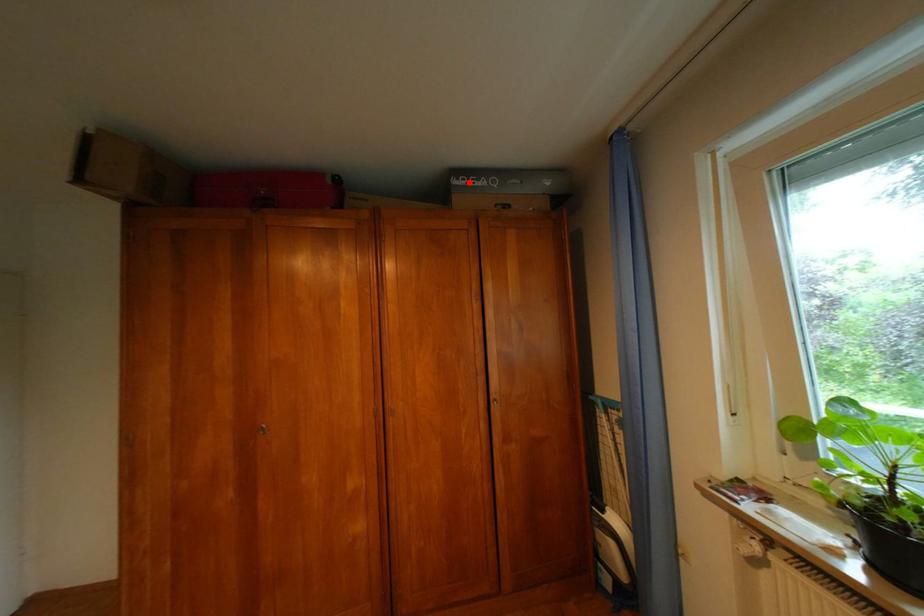
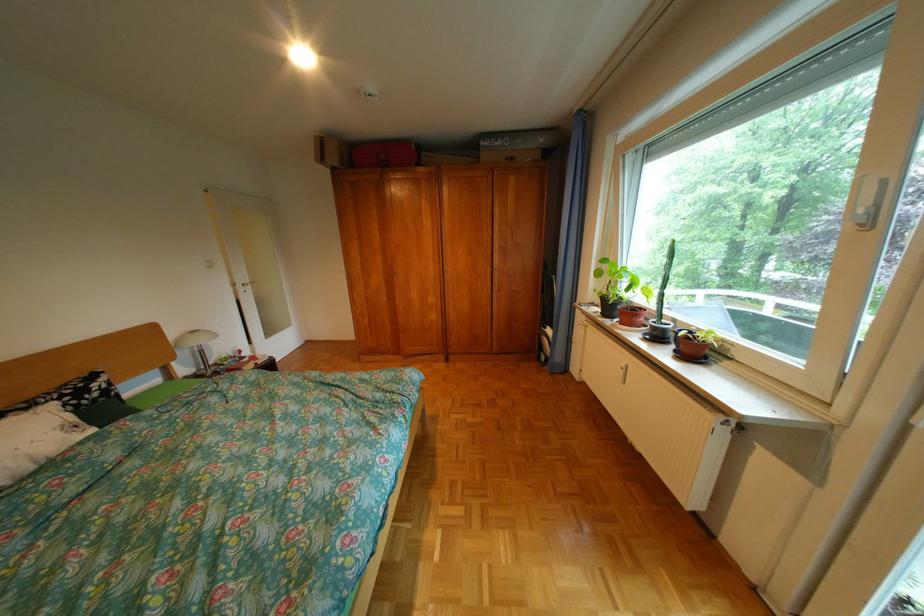
Question: A red point is marked in image1. In image2, is the corresponding 3D point closer to the camera or farther? Reply with the corresponding letter.

Choices:
 (A) The corresponding 3D point is closer.
 (B) The corresponding 3D point is farther.

Answer: (A)